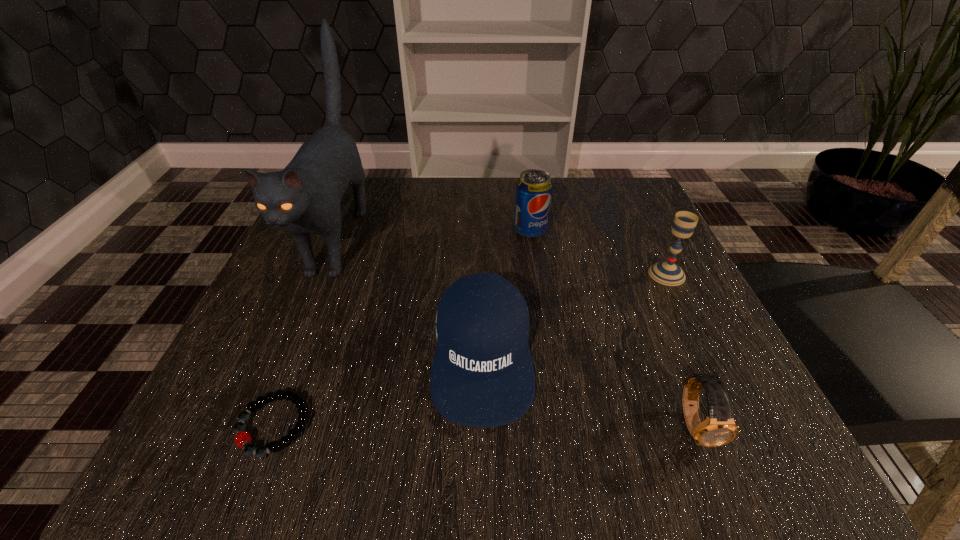
Locate an element on the screen. This screenshot has height=540, width=960. cat is located at coordinates (304, 198).

What are the coordinates of `soda` in the screenshot? It's located at (534, 189).

Identify the location of chalice. (668, 273).

This screenshot has width=960, height=540. Find the location of `baseball cap`. baseball cap is located at coordinates point(482,375).

Locate an element on the screen. Image resolution: width=960 pixels, height=540 pixels. the fifth tallest object is located at coordinates (719, 428).

Where is `the fifth object from left to right`? This screenshot has height=540, width=960. the fifth object from left to right is located at coordinates (719, 428).

At what (x,y) coordinates should I click in order to perform the action: click on the shortest object. Please return your answer as a coordinate pair (x, y). Looking at the image, I should click on (243, 439).

What are the coordinates of `free region located at the face of the cat` in the screenshot? It's located at (281, 374).

This screenshot has width=960, height=540. What are the coordinates of `free space located 0.280m on the front of the soda` in the screenshot? It's located at (548, 349).

Image resolution: width=960 pixels, height=540 pixels. What are the coordinates of `vacant space located 0.210m on the back of the rightmost object` in the screenshot? It's located at (633, 204).